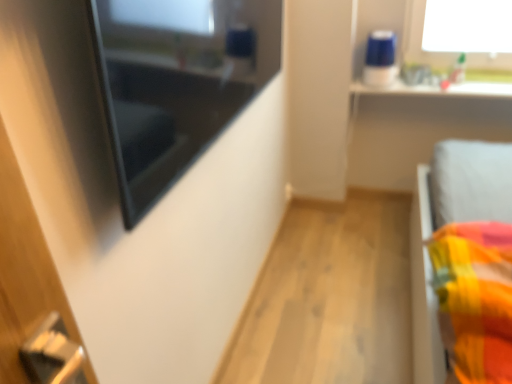
Where is `vacant point above white glossy window sill at upper right (from a real-world perspective)`? Image resolution: width=512 pixels, height=384 pixels. vacant point above white glossy window sill at upper right (from a real-world perspective) is located at coordinates (438, 83).